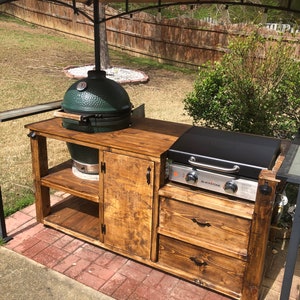
The width and height of the screenshot is (300, 300). I want to click on cabinet doors, so click(x=230, y=270), click(x=226, y=237), click(x=138, y=219).